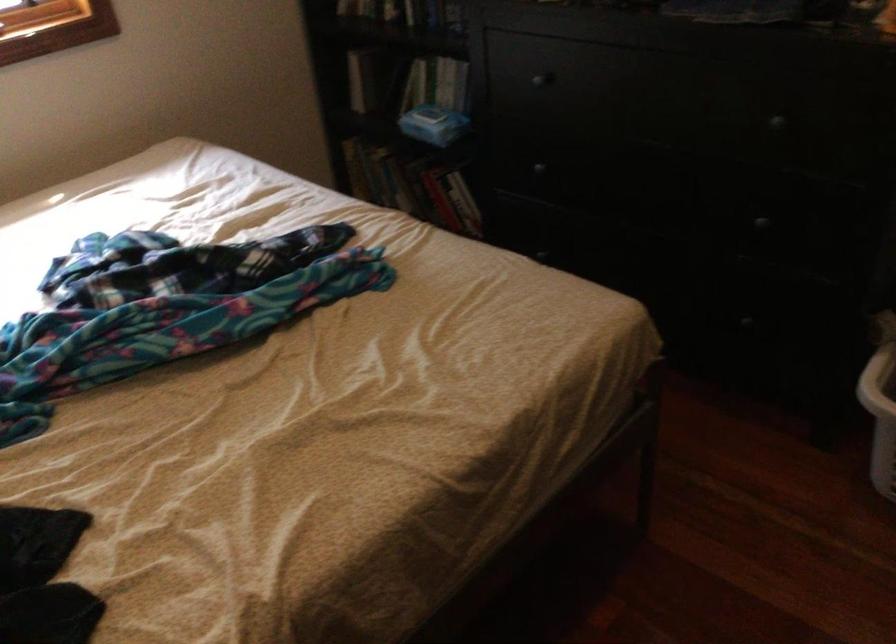
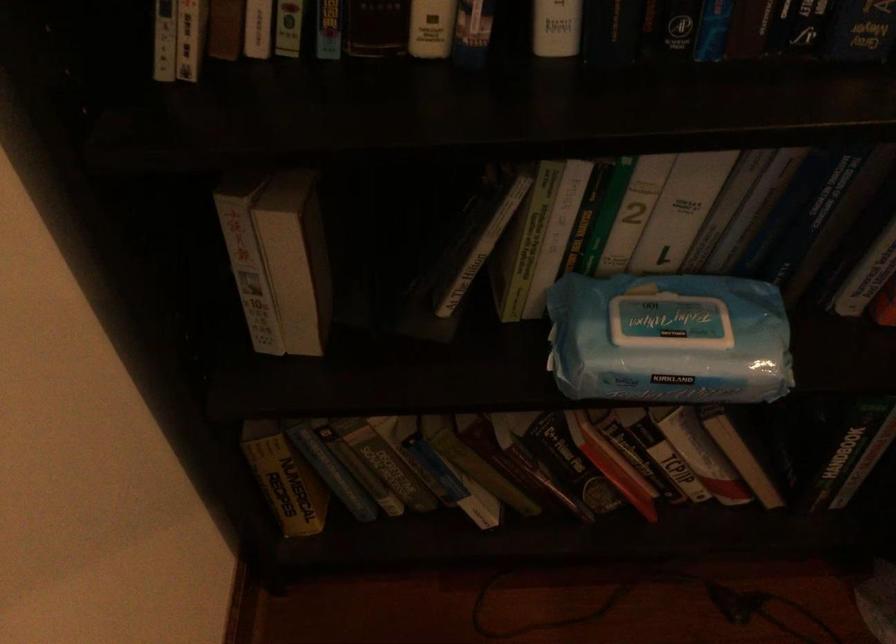
Where in the second image is the point corresponding to the point at 355,69 from the first image?

(296, 259)